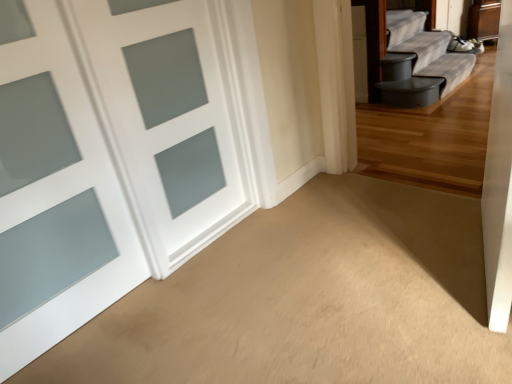
Identify the location of vacant area located to the right-hand side of white frosted glass door at left, which is the 2th door from left to right. Image resolution: width=512 pixels, height=384 pixels. (276, 224).